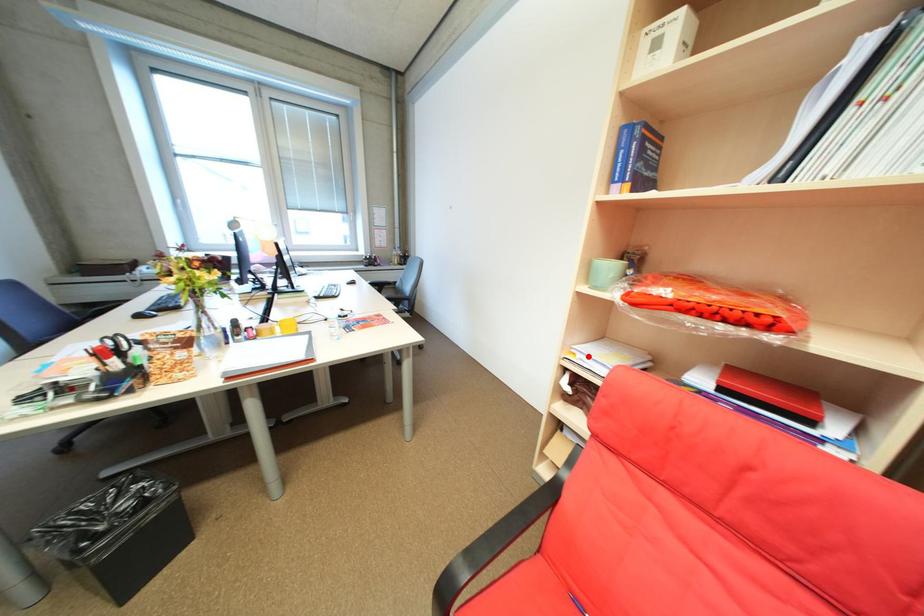
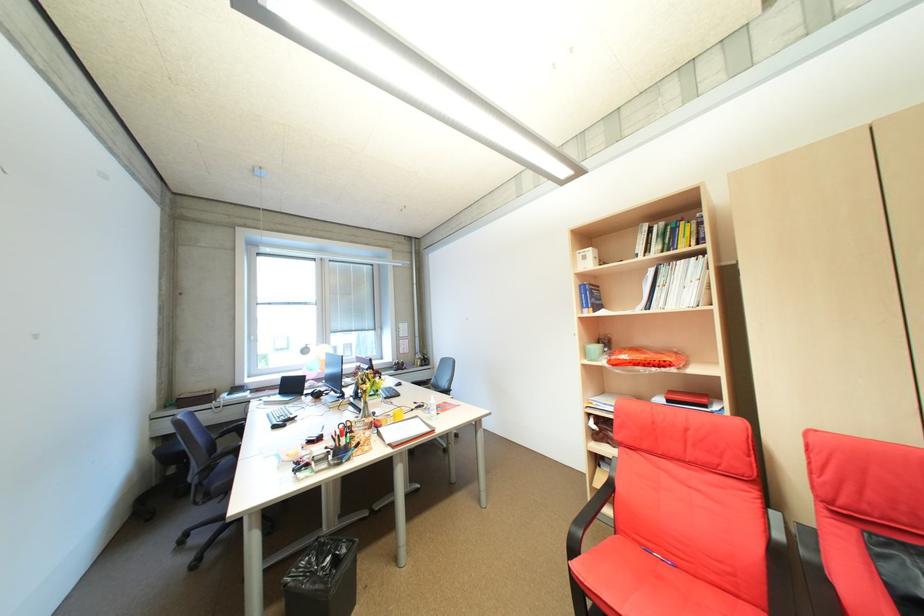
Question: I am providing you with two images of the same scene from different viewpoints. In image1, a red point is highlighted. Considering the same 3D point in image2, which of the following is correct?

Choices:
 (A) It is closer
 (B) It is farther

Answer: (B)